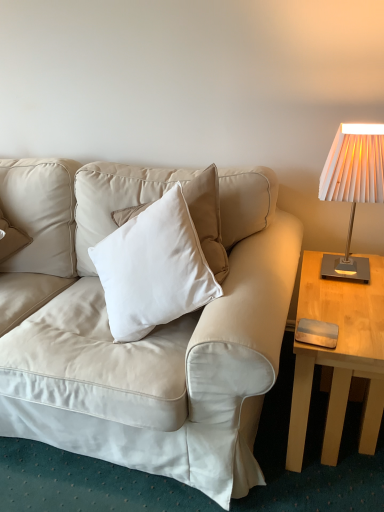
Locate an element on the screen. This screenshot has height=512, width=384. free space on the front side of white pleated fabric lampshade at right is located at coordinates pyautogui.click(x=352, y=305).